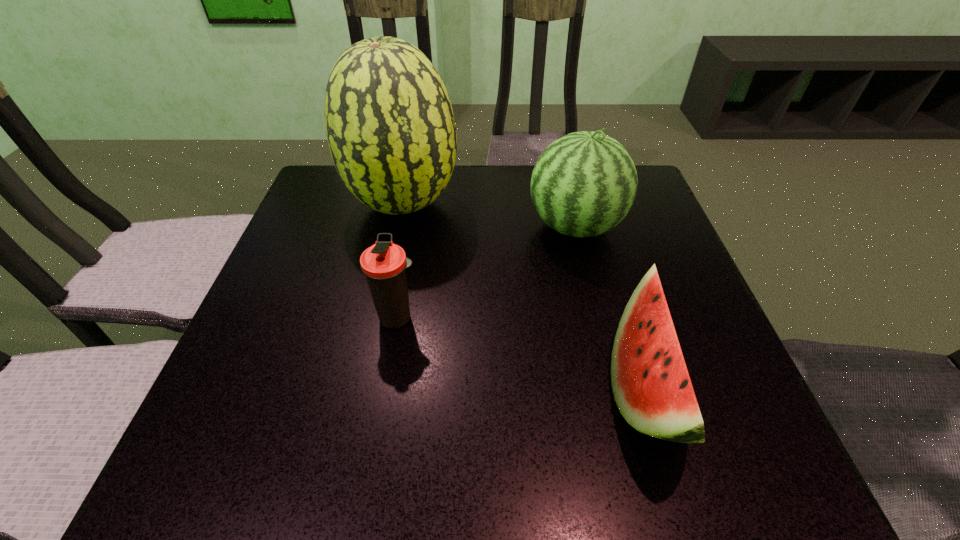
Identify which object is the third nearest to the tallest object. Please provide its 2D coordinates. Your answer should be formatted as a tuple, i.e. [(x, y)], where the tuple contains the x and y coordinates of a point satisfying the conditions above.

[(651, 385)]

Locate an element on the screen. Image resolution: width=960 pixels, height=540 pixels. object that is the third closest to the second tallest object is located at coordinates (384, 263).

Identify which watermelon is the second nearest to the tallest watermelon. Please provide its 2D coordinates. Your answer should be formatted as a tuple, i.e. [(x, y)], where the tuple contains the x and y coordinates of a point satisfying the conditions above.

[(651, 385)]

Identify which watermelon is the closest to the third shortest object. Please provide its 2D coordinates. Your answer should be formatted as a tuple, i.e. [(x, y)], where the tuple contains the x and y coordinates of a point satisfying the conditions above.

[(651, 385)]

The width and height of the screenshot is (960, 540). In order to click on vacant area in the image that satisfies the following two spatial constraints: 1. on the front side of the tallest watermelon; 2. on the right side of the third shortest object in this screenshot , I will do `click(398, 226)`.